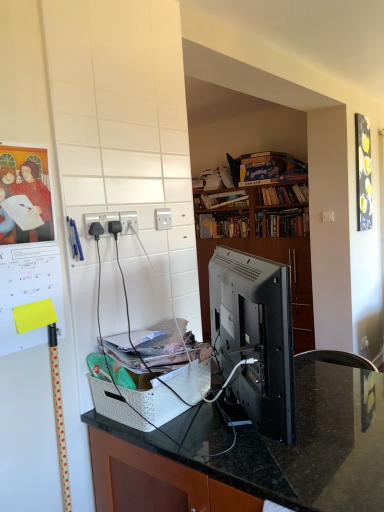
Question: Choose the correct answer: Is black plastic power outlet at center, acting as the 3th electric outlet starting from the back, inside white plastic basket at center or outside it?

Choices:
 (A) outside
 (B) inside

Answer: (A)

Question: From the image's perspective, relative to white plastic basket at center, is black plastic power outlet at center, which ranks as the third electric outlet in right-to-left order, above or below?

Choices:
 (A) above
 (B) below

Answer: (A)

Question: Which object is positioned farthest from the matte paper poster at upper left?

Choices:
 (A) satin black monitor at center
 (B) white plastic electric outlet at upper center, positioned as the 1th electric outlet in back-to-front order
 (C) hardcover book at center, which appears as the 2th book when ordered from the bottom
 (D) black glossy picture frame at upper right
 (E) black plastic power outlet at center, acting as the 3th electric outlet starting from the back

Answer: (C)

Question: Which object is positioned closest to the hardcover book at upper center, acting as the 6th book starting from the bottom?

Choices:
 (A) white plastic electrical outlet at center, which is counted as the second electric outlet, starting from the right
 (B) satin black monitor at center
 (C) black plastic power outlet at center, the first electric outlet when ordered from left to right
 (D) white plastic basket at center
 (E) black glossy picture frame at upper right

Answer: (E)